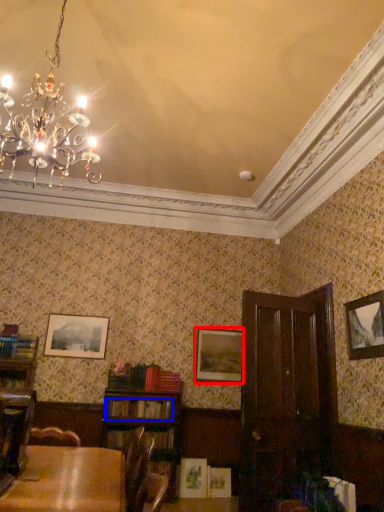
Question: Which of the following is the farthest to the observer, picture frame (highlighted by a red box) or book (highlighted by a blue box)?

Choices:
 (A) picture frame
 (B) book

Answer: (A)